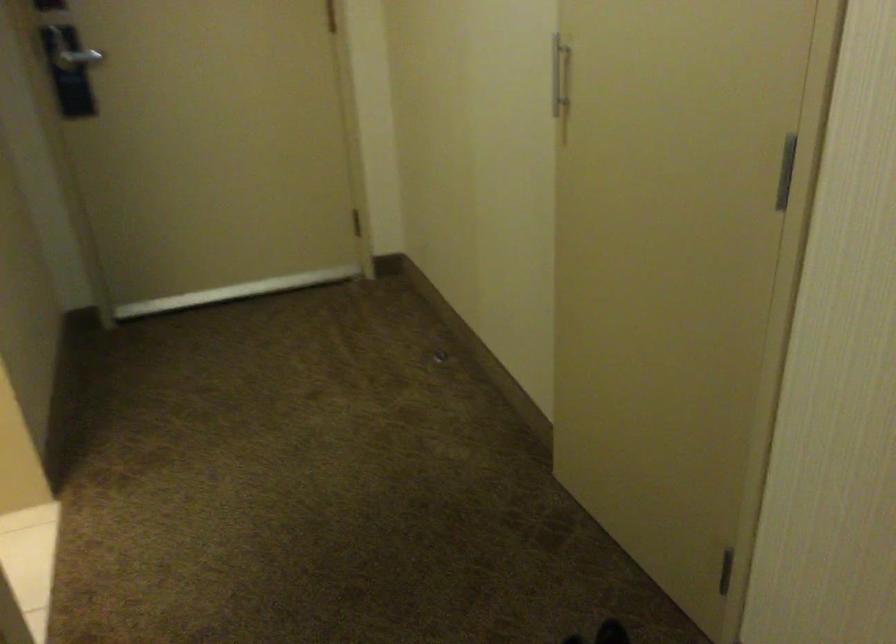
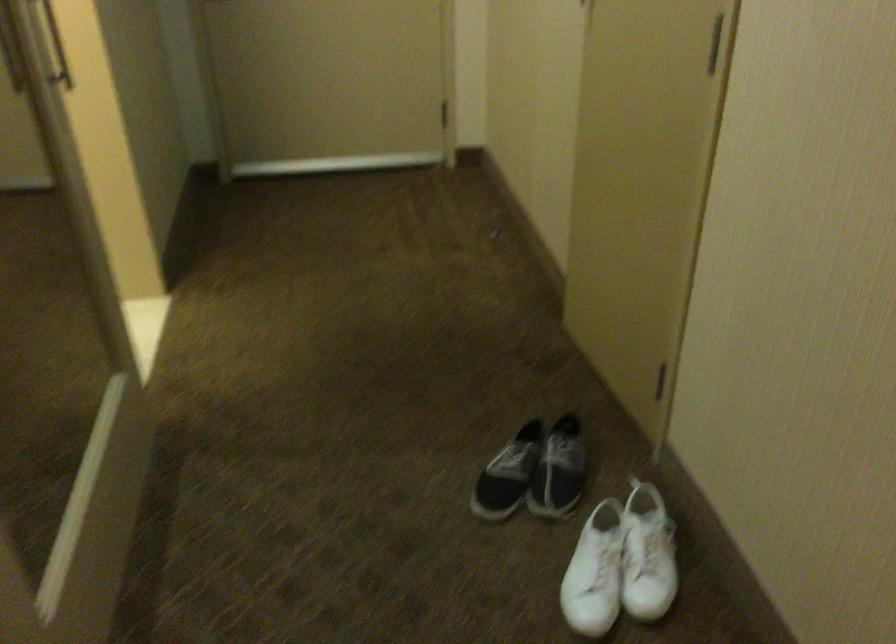
In a continuous first-person perspective shot, in which direction is the camera moving?

The cameraman walked toward right, backward.